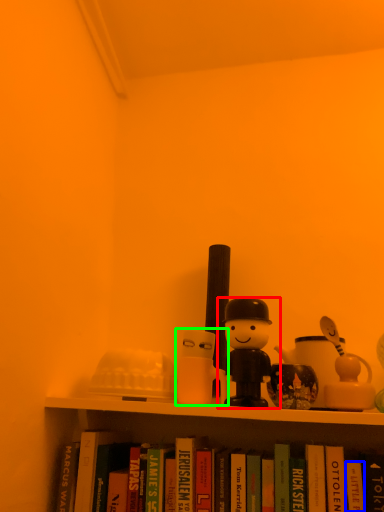
Question: Which is farther away from toy (highlighted by a red box)? paperback book (highlighted by a blue box) or toy (highlighted by a green box)?

Choices:
 (A) paperback book
 (B) toy

Answer: (A)